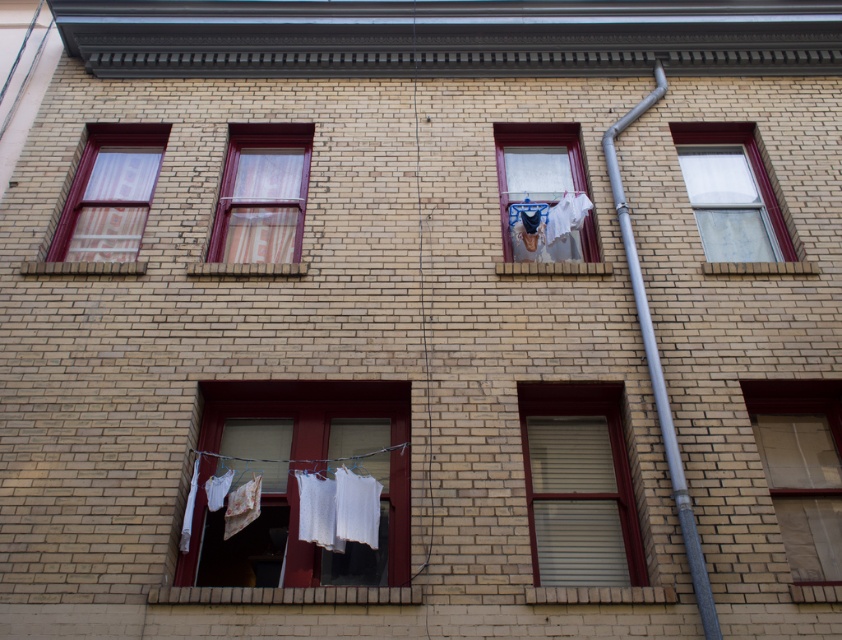
Is the position of white sheer curtain at center more distant than that of striped fabric window at center?

That is True.

Is white sheer curtain at center smaller than striped fabric window at center?

No, white sheer curtain at center is not smaller than striped fabric window at center.

Where is `white sheer curtain at center`? This screenshot has width=842, height=640. white sheer curtain at center is located at coordinates (542, 193).

Can you confirm if white fabric at lower center is positioned above matte glass window at lower right?

Incorrect, white fabric at lower center is not positioned above matte glass window at lower right.

Which is behind, point (216, 422) or point (803, 598)?

Point (216, 422)

At what (x,y) coordinates should I click in order to perform the action: click on white fabric at lower center. Please return your answer as a coordinate pair (x, y). The width and height of the screenshot is (842, 640). Looking at the image, I should click on (296, 481).

Between matte glass window at center and matte glass window at lower right, which one has less height?

Standing shorter between the two is matte glass window at lower right.

In order to click on matte glass window at center in this screenshot , I will do `click(578, 484)`.

Who is more distant from viewer, (578, 422) or (758, 449)?

The point (578, 422) is behind.

This screenshot has width=842, height=640. Identify the location of matte glass window at center. (578, 484).